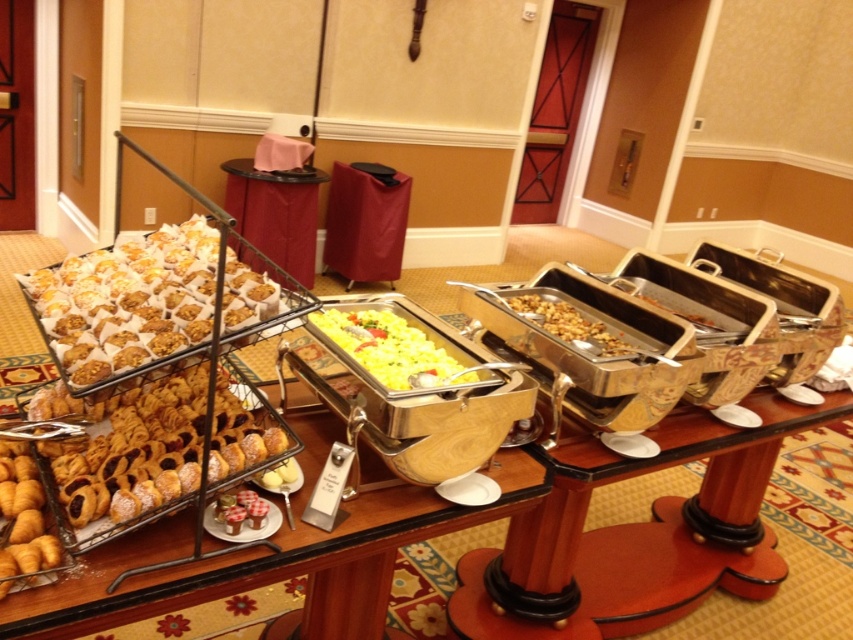
Question: Which of these objects is positioned farthest from the golden brown pastry at lower left?

Choices:
 (A) slightly browned wood at center
 (B) slightly toasted nuts at center
 (C) golden brown crumbly cookies at left

Answer: (A)

Question: Which point is farther to the camera?

Choices:
 (A) (181, 269)
 (B) (695, 316)

Answer: (B)

Question: Is metallic silver buffet at center below golden brown pastry at lower left?

Choices:
 (A) no
 (B) yes

Answer: (B)

Question: Is golden brown pastry at lower left further to camera compared to golden brown croissant at lower left?

Choices:
 (A) yes
 (B) no

Answer: (A)

Question: Is metallic silver buffet at center above slightly toasted nuts at center?

Choices:
 (A) no
 (B) yes

Answer: (A)

Question: Among these points, which one is nearest to the camera?

Choices:
 (A) pyautogui.click(x=732, y=472)
 (B) pyautogui.click(x=701, y=317)
 (C) pyautogui.click(x=68, y=280)

Answer: (C)